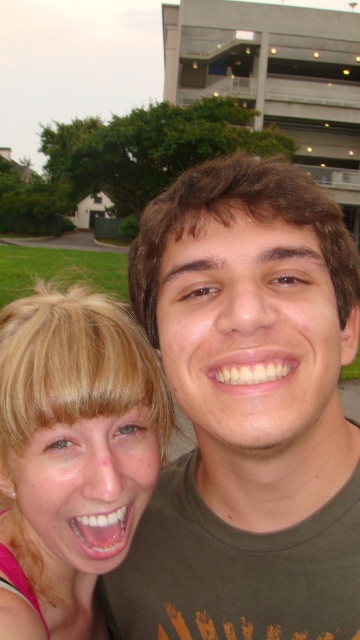
How distant is matte green t-shirt at center from blonde hair at left?

matte green t-shirt at center and blonde hair at left are 6.71 inches apart from each other.

Which is behind, point (321, 470) or point (90, 602)?

Point (90, 602)

Where is `matte green t-shirt at center`? The height and width of the screenshot is (640, 360). matte green t-shirt at center is located at coordinates (248, 412).